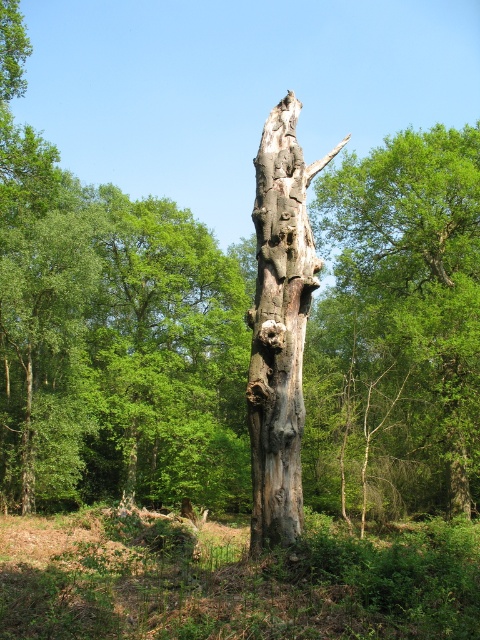
Question: In this image, where is gray rough bark tree at center located relative to grayish-brown bark tree trunk at center?

Choices:
 (A) left
 (B) right

Answer: (B)

Question: Which of the following is the farthest from the observer?

Choices:
 (A) grayish-brown bark tree trunk at center
 (B) gray rough bark tree at center

Answer: (B)

Question: Which of the following is the closest to the observer?

Choices:
 (A) gray rough bark tree at center
 (B) grayish-brown bark tree trunk at center

Answer: (B)

Question: Is gray rough bark tree at center bigger than grayish-brown bark tree trunk at center?

Choices:
 (A) yes
 (B) no

Answer: (B)

Question: Is gray rough bark tree at center closer to the viewer compared to grayish-brown bark tree trunk at center?

Choices:
 (A) yes
 (B) no

Answer: (B)